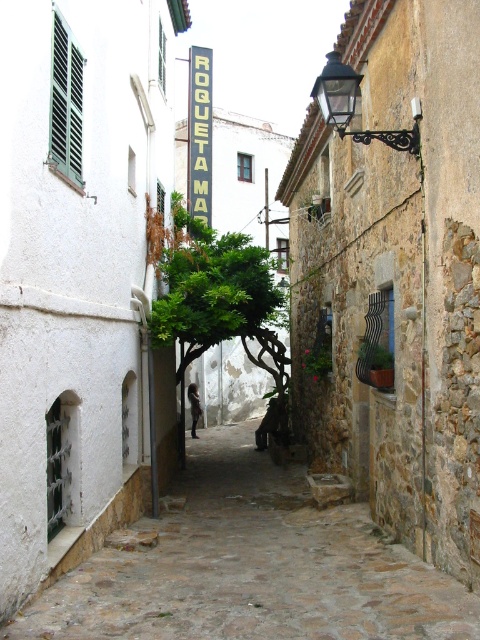
Question: Which object appears closest to the camera in this image?

Choices:
 (A) stone paved path at center
 (B) black plastic sign at upper center

Answer: (A)

Question: Is stone paved path at center further to the viewer compared to black plastic sign at upper center?

Choices:
 (A) no
 (B) yes

Answer: (A)

Question: Does green leafy tree at center lie behind black plastic sign at upper center?

Choices:
 (A) no
 (B) yes

Answer: (A)

Question: Among these objects, which one is nearest to the camera?

Choices:
 (A) stone paved path at center
 (B) black plastic sign at upper center
 (C) green leafy tree at center

Answer: (A)

Question: Estimate the real-world distances between objects in this image. Which object is farther from the stone paved path at center?

Choices:
 (A) black plastic sign at upper center
 (B) green leafy tree at center

Answer: (A)

Question: Can you confirm if stone paved path at center is positioned above green leafy tree at center?

Choices:
 (A) no
 (B) yes

Answer: (A)